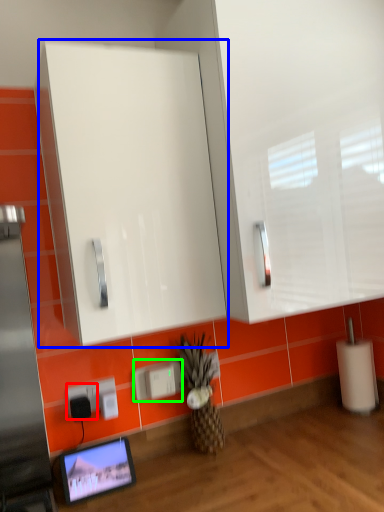
Question: Which object is the closest to the electric outlet (highlighted by a red box)? Choose among these: glass door (highlighted by a blue box) or electric outlet (highlighted by a green box).

Choices:
 (A) glass door
 (B) electric outlet

Answer: (B)